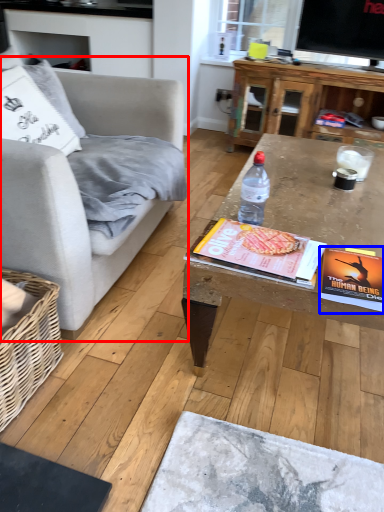
Question: Which object appears farthest to the camera in this image, studio couch (highlighted by a red box) or paperback book (highlighted by a blue box)?

Choices:
 (A) studio couch
 (B) paperback book

Answer: (B)